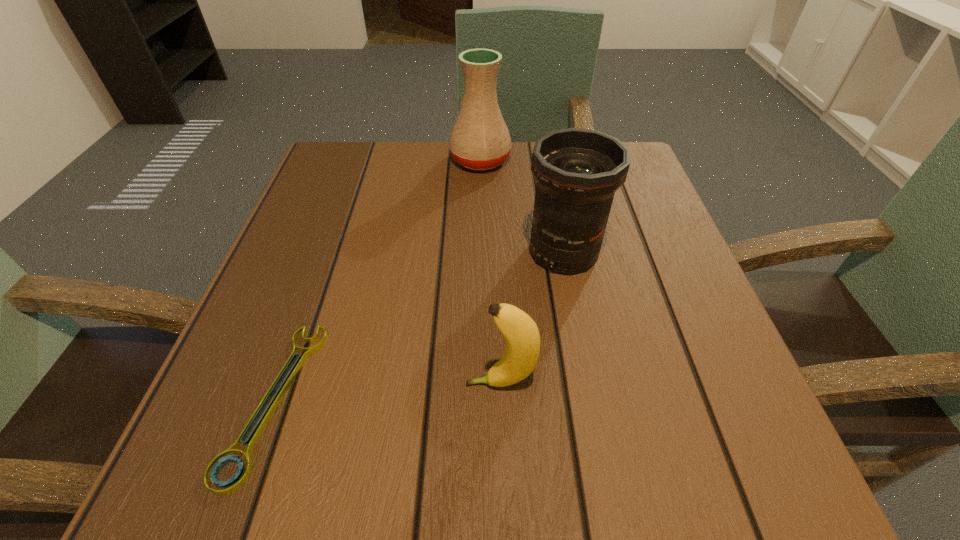
Find the location of a particular element. The height and width of the screenshot is (540, 960). vacant space located from the stem of the banana is located at coordinates (x=351, y=383).

Identify the location of free space located 0.220m on the back of the leftmost object. This screenshot has height=540, width=960. (333, 235).

Image resolution: width=960 pixels, height=540 pixels. I want to click on object at the far edge, so click(x=480, y=140).

You are a GUI agent. You are given a task and a screenshot of the screen. Output one action in this format:
    pyautogui.click(x=<x>, y=<y>)
    Task: Click on the object present at the near edge
    The image size is (960, 540).
    Given the screenshot: What is the action you would take?
    pyautogui.click(x=213, y=469)

At what (x,y) coordinates should I click in order to perform the action: click on object present at the left edge. Please return your answer as a coordinate pair (x, y). This screenshot has width=960, height=540. Looking at the image, I should click on (213, 469).

The width and height of the screenshot is (960, 540). Find the location of `object present at the right edge`. object present at the right edge is located at coordinates (577, 171).

This screenshot has height=540, width=960. I want to click on object present at the near left corner, so click(213, 469).

In the image, there is a desktop. Where is `vacant region at the far edge`? vacant region at the far edge is located at coordinates (419, 145).

This screenshot has height=540, width=960. Identify the location of vacant space at the near edge of the desktop. (352, 460).

Find the location of a particular element. vacant region at the left edge of the desktop is located at coordinates (350, 270).